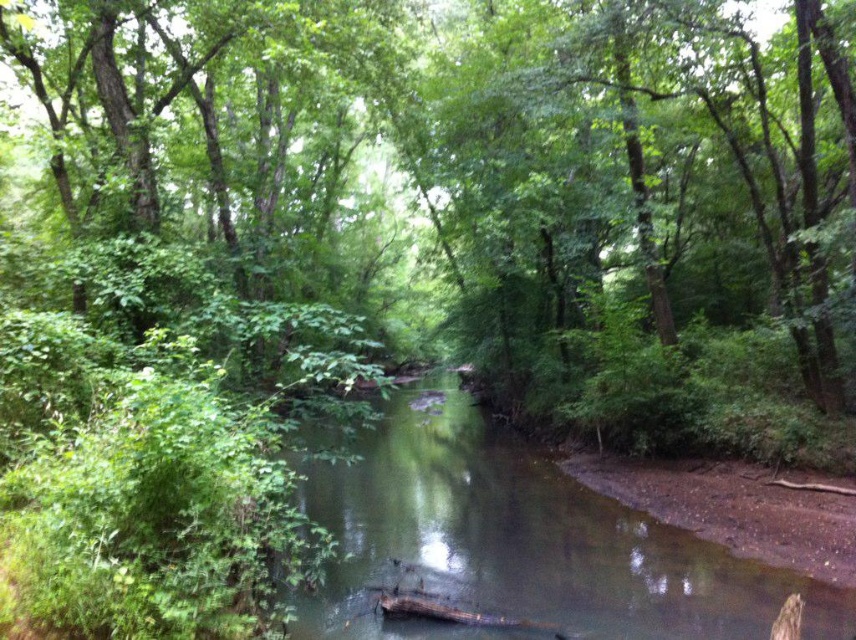
You are a kayaker paddling down the stream. You see the green leafy tree at center and the clear water at center. Which object is directly above the other?

The green leafy tree at center is positioned over the clear water at center, so the green leafy tree at center is directly above the clear water at center.

You are standing at the edge of the stream and notice two points marked in the scene. Which point, point (366, 29) or point (337, 598), is closer to you?

Point (366, 29) is further to the camera than point (337, 598), so the closer point to you is point (337, 598).

You are a hiker who wants to cross the stream. You see the green leafy tree at center and the clear water at center. Which object can you use to help you cross the stream safely?

The green leafy tree at center is larger in size than the clear water at center, so you can use the green leafy tree at center to help you cross the stream safely.